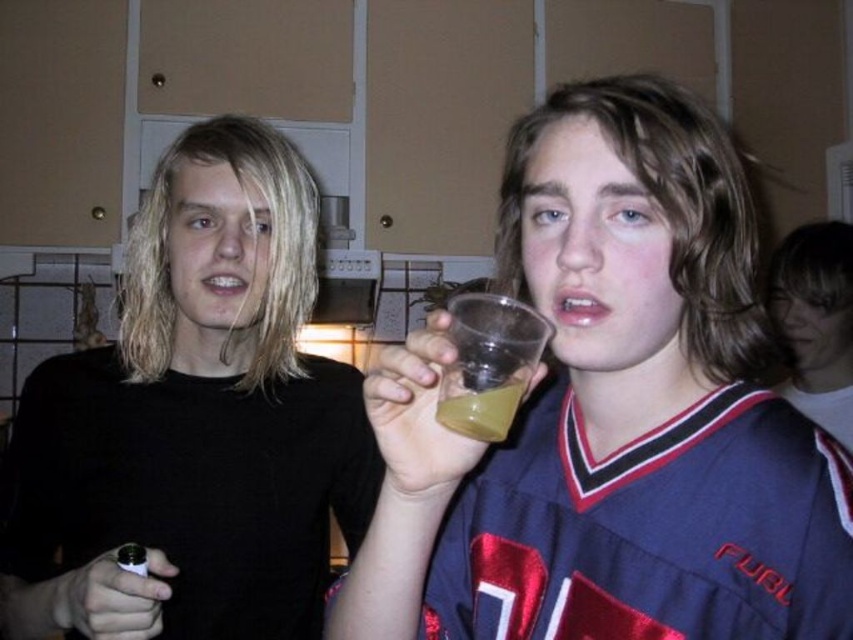
Looking at this image, you are a delivery person who needs to place a small package on the table where the transparent plastic cup at center is located. The package requires a minimum of 20 inches of space to avoid tipping over. Can you safely place the package there?

The transparent plastic cup at center is 18.66 inches away from the viewer, which means there is insufficient space to safely place the package as it requires at least 20 inches of space to avoid tipping over.